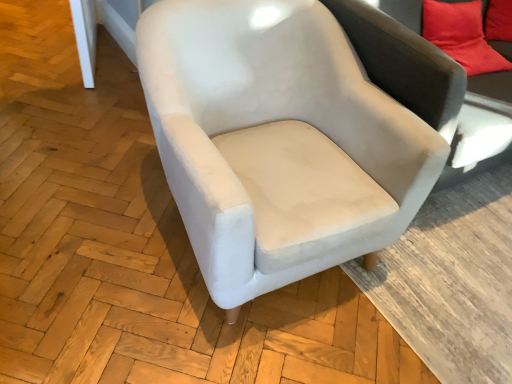
The image size is (512, 384). Identify the location of suede-like beige armchair at center. tap(273, 125).

What are the coordinates of `velvet-like gray couch at upper right` in the screenshot? It's located at (492, 85).

Between velvet-like gray couch at upper right and velvet beige swivel chair at center, which one is positioned behind?

velvet-like gray couch at upper right is behind.

Considering the positions of points (487, 91) and (372, 32), is point (487, 91) farther from camera compared to point (372, 32)?

Yes, point (487, 91) is behind point (372, 32).

In the scene shown: Is velvet beige swivel chair at center inside velvet-like gray couch at upper right?

No, velvet beige swivel chair at center is not a part of velvet-like gray couch at upper right.

How distant is velvet-like gray couch at upper right from velvet beige swivel chair at center?

velvet-like gray couch at upper right and velvet beige swivel chair at center are 26.02 inches apart from each other.

Consider the image. Are velvet red pillow at upper right and velvet-like gray couch at upper right far apart?

Actually, velvet red pillow at upper right and velvet-like gray couch at upper right are a little close together.

Is velvet red pillow at upper right positioned beyond the bounds of velvet-like gray couch at upper right?

That's correct, velvet red pillow at upper right is outside of velvet-like gray couch at upper right.

The image size is (512, 384). In order to click on pillow behind the velvet-like gray couch at upper right in this screenshot , I will do `click(461, 35)`.

From a real-world perspective, is velvet red pillow at upper right above or below velvet-like gray couch at upper right?

velvet red pillow at upper right is below velvet-like gray couch at upper right.

Is velvet-like gray couch at upper right aimed at velvet red pillow at upper right?

No, velvet-like gray couch at upper right is not oriented towards velvet red pillow at upper right.

Is velvet-like gray couch at upper right positioned behind velvet red pillow at upper right?

No, it is in front of velvet red pillow at upper right.

Can you confirm if velvet-like gray couch at upper right is positioned to the left of velvet red pillow at upper right?

Yes, velvet-like gray couch at upper right is to the left of velvet red pillow at upper right.

Which is in front, point (409, 75) or point (406, 13)?

Point (409, 75)

Where is `couch on the left of velvet beige swivel chair at center`? couch on the left of velvet beige swivel chair at center is located at coordinates (492, 85).

From a real-world perspective, is velvet beige swivel chair at center above or below velvet-like gray couch at upper right?

Clearly, from a real-world perspective, velvet beige swivel chair at center is below velvet-like gray couch at upper right.

From the image's perspective, is velvet beige swivel chair at center located above velvet-like gray couch at upper right?

No.

I want to click on couch on the right of the suede-like beige armchair at center, so click(492, 85).

Is suede-like beige armchair at center far from velvet-like gray couch at upper right?

That's not correct — suede-like beige armchair at center is a little close to velvet-like gray couch at upper right.

Looking at this image, how distant is suede-like beige armchair at center from velvet-like gray couch at upper right?

A distance of 37.93 inches exists between suede-like beige armchair at center and velvet-like gray couch at upper right.

Is suede-like beige armchair at center inside the boundaries of velvet-like gray couch at upper right, or outside?

suede-like beige armchair at center exists outside the volume of velvet-like gray couch at upper right.

Is suede-like beige armchair at center next to velvet red pillow at upper right and touching it?

No, suede-like beige armchair at center is not beside velvet red pillow at upper right.

Is suede-like beige armchair at center further to camera compared to velvet red pillow at upper right?

No, the depth of suede-like beige armchair at center is less than that of velvet red pillow at upper right.

From a real-world perspective, is suede-like beige armchair at center positioned over velvet red pillow at upper right based on gravity?

Actually, suede-like beige armchair at center is physically below velvet red pillow at upper right in the real world.

Does suede-like beige armchair at center have a smaller size compared to velvet red pillow at upper right?

No, suede-like beige armchair at center is not smaller than velvet red pillow at upper right.

Based on the photo, can we say velvet beige swivel chair at center lies outside suede-like beige armchair at center?

Yes, velvet beige swivel chair at center is not within suede-like beige armchair at center.

Is velvet beige swivel chair at center taller than suede-like beige armchair at center?

Yes, velvet beige swivel chair at center is taller than suede-like beige armchair at center.

Is point (429, 106) closer or farther from the camera than point (138, 27)?

Point (429, 106) appears to be farther away from the viewer than point (138, 27).

At what (x,y) coordinates should I click in order to perform the action: click on couch behind the velvet beige swivel chair at center. Please return your answer as a coordinate pair (x, y). Looking at the image, I should click on (492, 85).

The height and width of the screenshot is (384, 512). Find the location of `pillow on the right of velvet-like gray couch at upper right`. pillow on the right of velvet-like gray couch at upper right is located at coordinates (461, 35).

Looking at the image, which one is located closer to velvet-like gray couch at upper right, suede-like beige armchair at center or velvet red pillow at upper right?

Based on the image, velvet red pillow at upper right appears to be nearer to velvet-like gray couch at upper right.

When comparing their distances from velvet-like gray couch at upper right, does velvet red pillow at upper right or velvet beige swivel chair at center seem further?

velvet beige swivel chair at center is further to velvet-like gray couch at upper right.

When comparing their distances from suede-like beige armchair at center, does velvet beige swivel chair at center or velvet-like gray couch at upper right seem further?

velvet-like gray couch at upper right is further to suede-like beige armchair at center.

Considering their positions, is velvet-like gray couch at upper right positioned further to velvet beige swivel chair at center than suede-like beige armchair at center?

velvet-like gray couch at upper right.

Based on their spatial positions, is velvet beige swivel chair at center or velvet-like gray couch at upper right closer to velvet red pillow at upper right?

The object closer to velvet red pillow at upper right is velvet-like gray couch at upper right.

When comparing their distances from suede-like beige armchair at center, does velvet red pillow at upper right or velvet-like gray couch at upper right seem closer?

velvet red pillow at upper right lies closer to suede-like beige armchair at center than the other object.

Looking at the image, which one is located closer to velvet beige swivel chair at center, velvet red pillow at upper right or suede-like beige armchair at center?

Among the two, suede-like beige armchair at center is located nearer to velvet beige swivel chair at center.

Based on their spatial positions, is velvet beige swivel chair at center or suede-like beige armchair at center further from velvet red pillow at upper right?

suede-like beige armchair at center is further to velvet red pillow at upper right.

Locate an element on the screen. The height and width of the screenshot is (384, 512). couch situated between suede-like beige armchair at center and velvet red pillow at upper right from left to right is located at coordinates (492, 85).

Where is `swivel chair between suede-like beige armchair at center and velvet red pillow at upper right from left to right`? This screenshot has width=512, height=384. swivel chair between suede-like beige armchair at center and velvet red pillow at upper right from left to right is located at coordinates 403,62.

At what (x,y) coordinates should I click in order to perform the action: click on couch between suede-like beige armchair at center and velvet beige swivel chair at center. Please return your answer as a coordinate pair (x, y). Image resolution: width=512 pixels, height=384 pixels. Looking at the image, I should click on (492, 85).

I want to click on couch between velvet beige swivel chair at center and velvet red pillow at upper right in the front-back direction, so click(x=492, y=85).